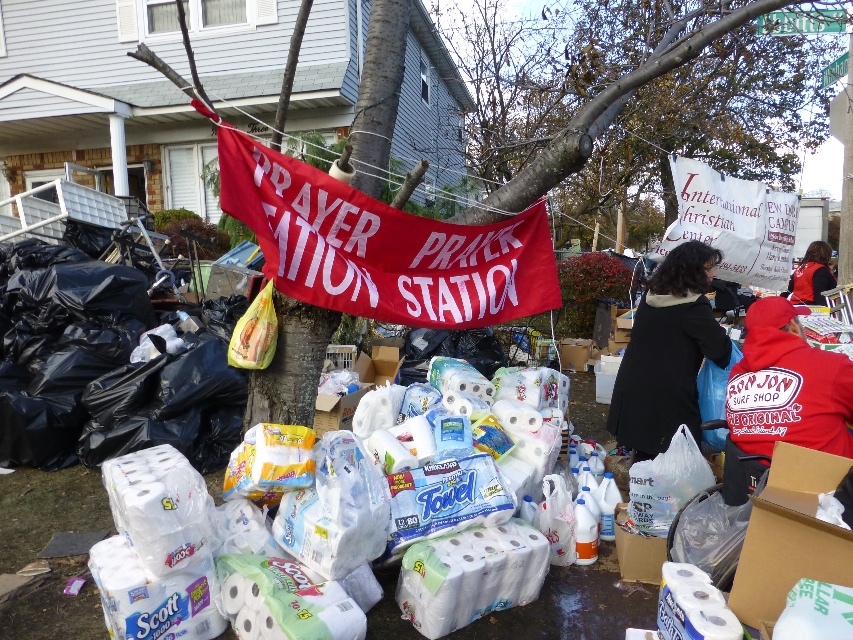
You are a volunteer at the relief effort and need to distribute items from the donations. You notice two points marked in the scene. Which point is closer to you, point at coordinate (x=263, y=236) or point at coordinate (x=808, y=266)?

Point at coordinate (x=263, y=236) is in front of point at coordinate (x=808, y=266), so it is closer to you.

You are a volunteer at the relief effort scene. You need to determine which object is larger between the smooth bark tree at center and the red cotton vest at center. Which one is bigger?

The smooth bark tree at center is bigger than the red cotton vest at center.